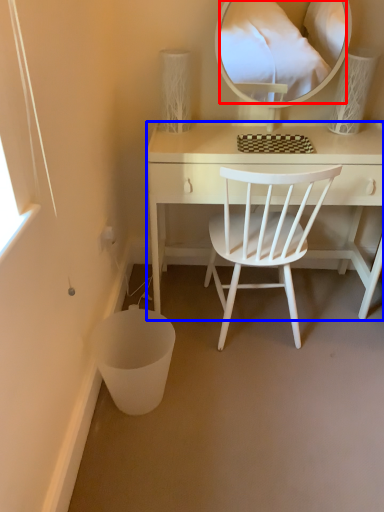
Question: Among these objects, which one is nearest to the camera, mirror (highlighted by a red box) or desk (highlighted by a blue box)?

Choices:
 (A) mirror
 (B) desk

Answer: (A)